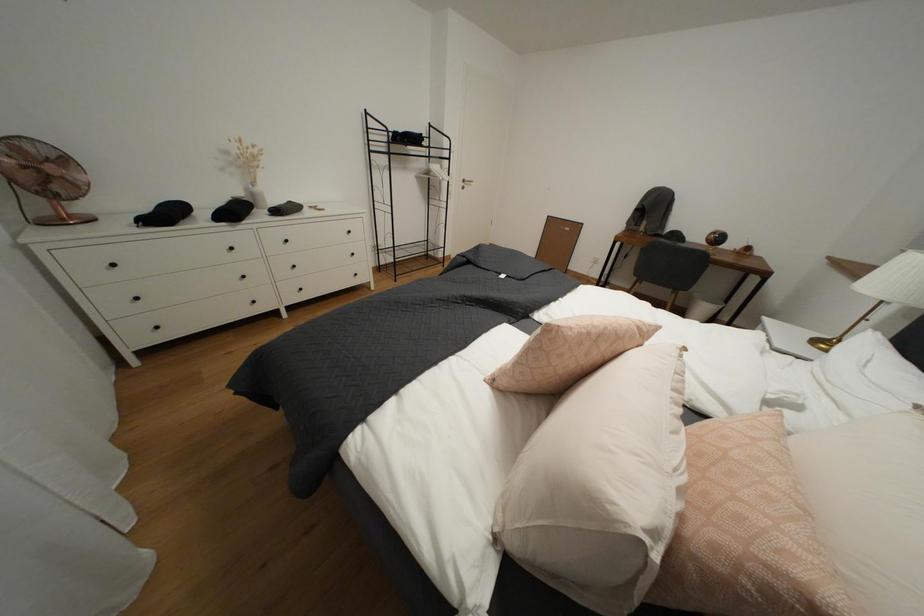
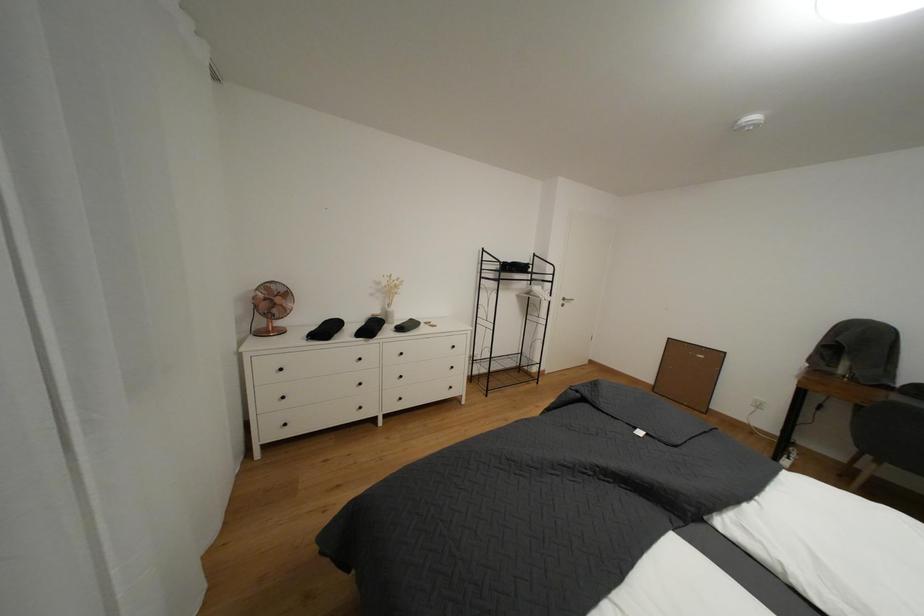
First-person continuous shooting, in which direction is the camera rotating?

The camera rotated toward left-up.